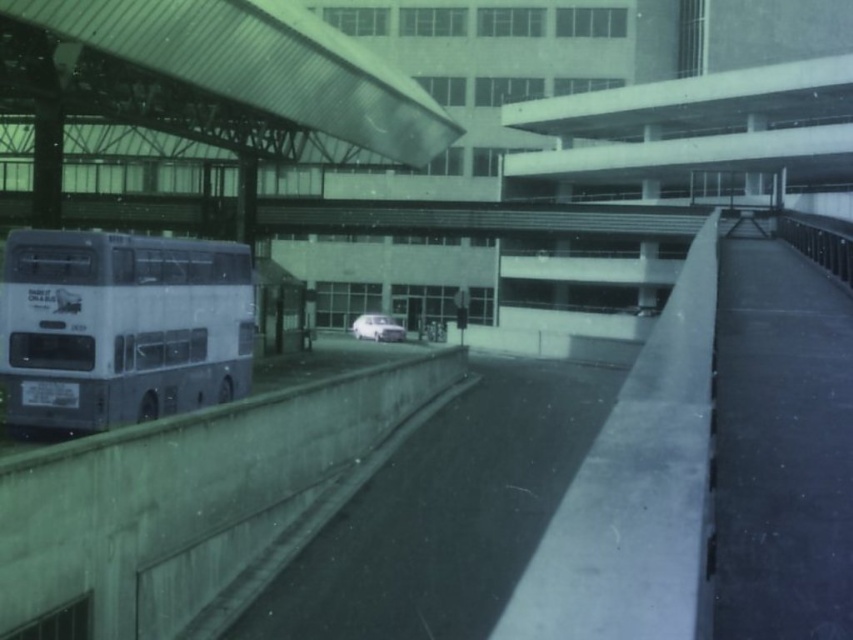
Which is in front, point (241, 384) or point (381, 330)?

Point (241, 384) is in front.

Can you confirm if silver metallic bus at left is shorter than white matte van at center?

No, silver metallic bus at left is not shorter than white matte van at center.

Which is behind, point (231, 349) or point (355, 333)?

The point (355, 333) is behind.

At what (x,y) coordinates should I click in order to perform the action: click on silver metallic bus at left. Please return your answer as a coordinate pair (x, y). Looking at the image, I should click on (120, 326).